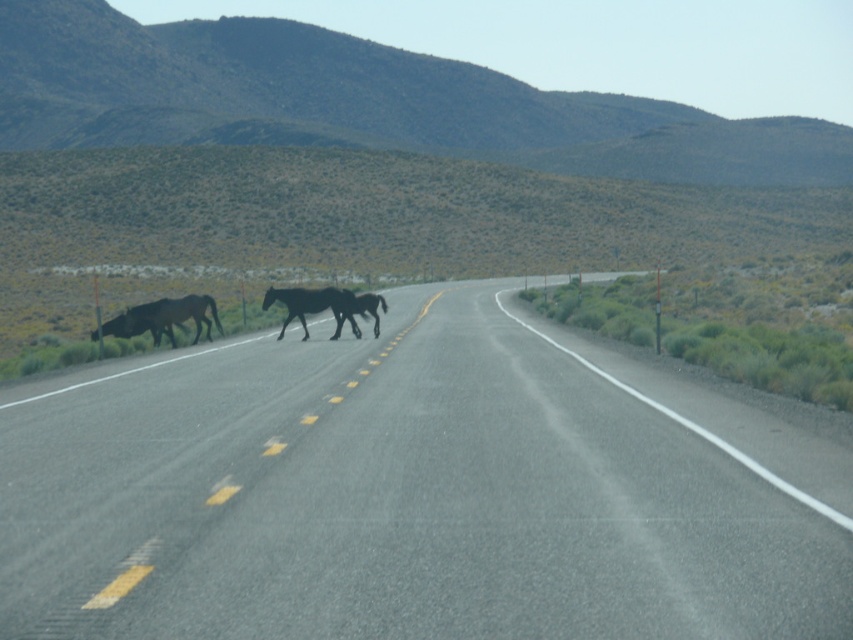
Question: Which of the following is the farthest from the observer?

Choices:
 (A) black glossy horse at center
 (B) dark brown glossy horse at center

Answer: (B)

Question: Which object is farther from the camera taking this photo?

Choices:
 (A) black asphalt highway at center
 (B) dark brown horse at center
 (C) dark brown glossy horse at center

Answer: (C)

Question: From the image, what is the correct spatial relationship of black asphalt highway at center in relation to dark brown glossy horse at center?

Choices:
 (A) above
 (B) below

Answer: (B)

Question: Does dark brown horse at center lie behind black glossy horse at center?

Choices:
 (A) no
 (B) yes

Answer: (B)

Question: Estimate the real-world distances between objects in this image. Which object is closer to the dark brown glossy horse at center?

Choices:
 (A) black asphalt highway at center
 (B) dark brown horse at center
 (C) black glossy horse at center

Answer: (C)

Question: Is black asphalt highway at center to the right of dark brown horse at center from the viewer's perspective?

Choices:
 (A) yes
 (B) no

Answer: (A)